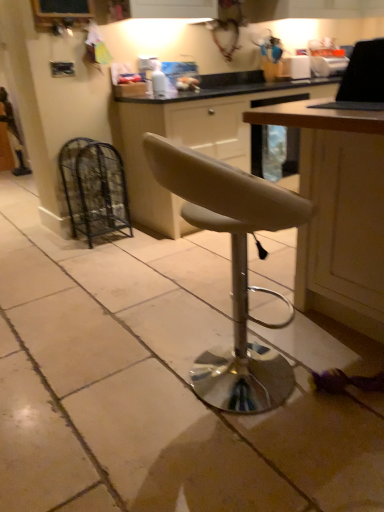
Locate an element on the screen. free space in front of black wire mesh cage at left is located at coordinates (95, 255).